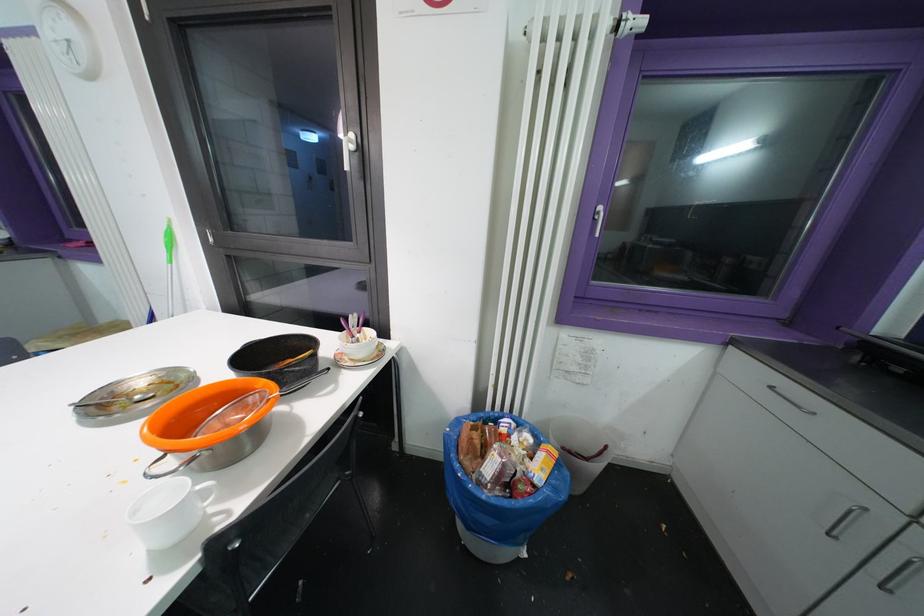
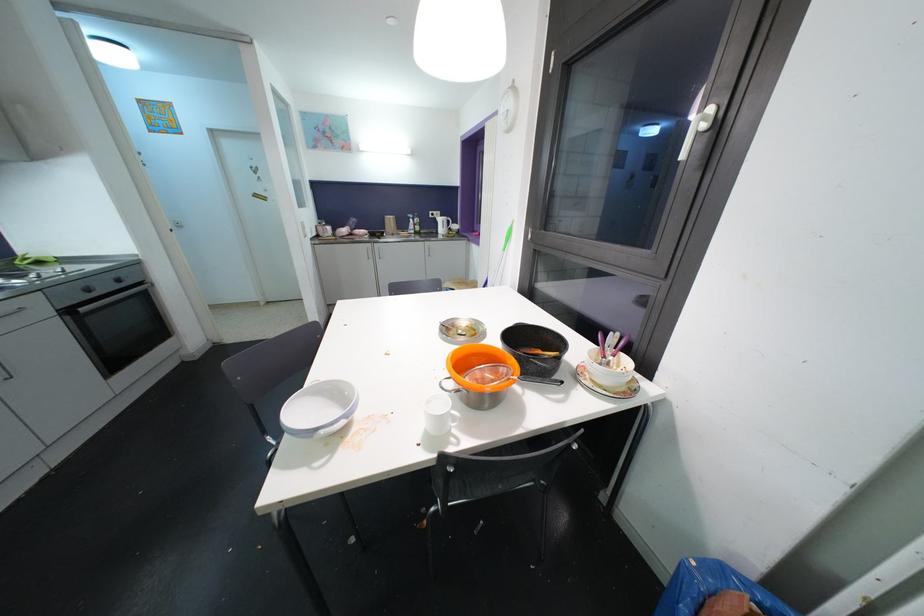
In the second image, find the point that corresponds to point 355,138 in the first image.

(713, 111)